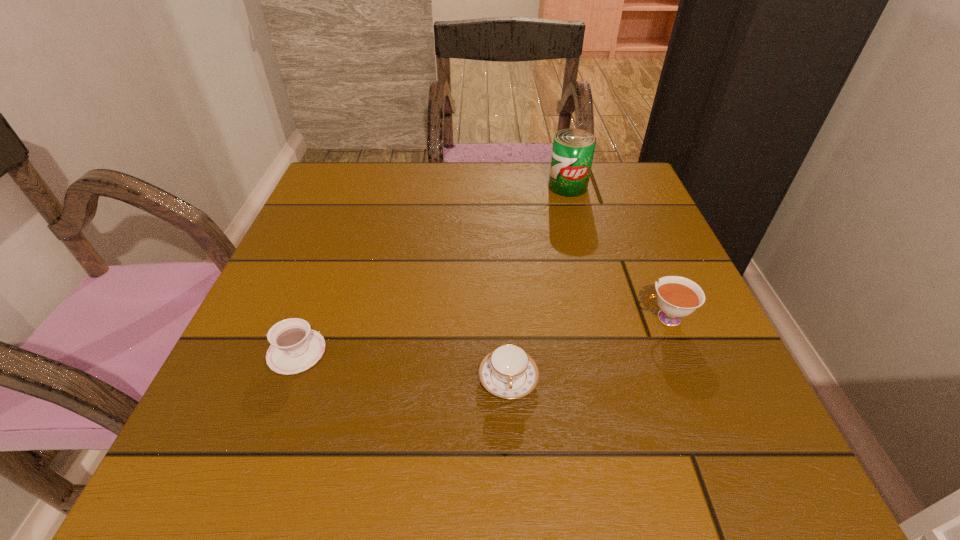
Locate an element on the screen. blank region between the leftmost object and the second teacup from left to right is located at coordinates (402, 365).

I want to click on vacant point located between the rightmost object and the leftmost teacup, so click(x=481, y=335).

I want to click on empty space between the second teacup from left to right and the leftmost object, so click(402, 365).

This screenshot has height=540, width=960. What are the coordinates of `free spot between the can and the second object from left to right` in the screenshot? It's located at (538, 282).

Find the location of a particular element. The height and width of the screenshot is (540, 960). vacant area between the second object from left to right and the leftmost object is located at coordinates (402, 365).

Identify which object is located as the third nearest to the tallest object. Please provide its 2D coordinates. Your answer should be formatted as a tuple, i.e. [(x, y)], where the tuple contains the x and y coordinates of a point satisfying the conditions above.

[(295, 347)]

Find the location of a particular element. The height and width of the screenshot is (540, 960). object that is the third closest to the third object from left to right is located at coordinates pos(295,347).

Identify the location of teacup that is the third closest to the farthest object. The height and width of the screenshot is (540, 960). (295, 347).

Select which teacup is the closest to the second teacup from right to left. Please provide its 2D coordinates. Your answer should be formatted as a tuple, i.e. [(x, y)], where the tuple contains the x and y coordinates of a point satisfying the conditions above.

[(677, 297)]

Find the location of a particular element. Image resolution: width=960 pixels, height=540 pixels. vacant space that satisfies the following two spatial constraints: 1. on the side of the tallest teacup with the handle; 2. on the side with the handle of the second teacup from left to right is located at coordinates (690, 379).